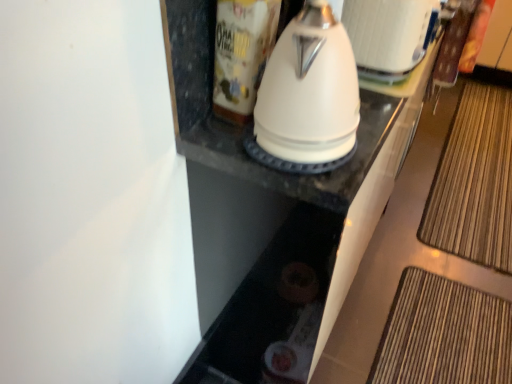
Locate an element on the screen. This screenshot has height=384, width=512. free space above bamboo mat at lower right (from a real-world perspective) is located at coordinates (475, 168).